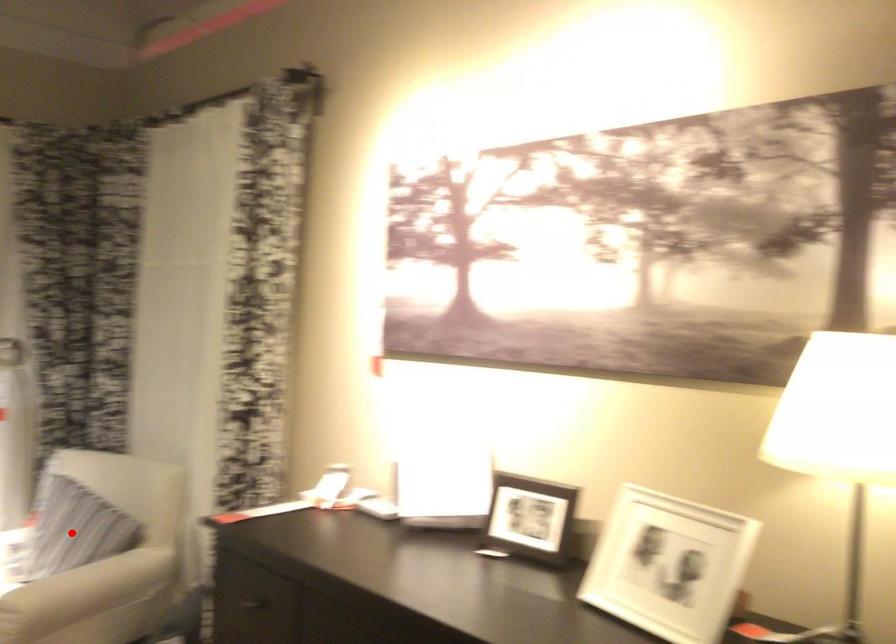
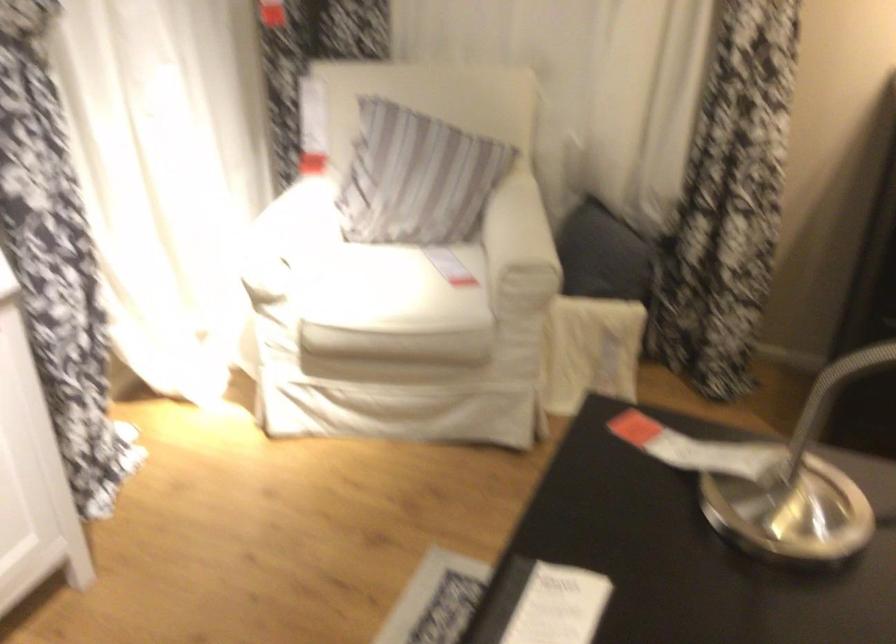
Find the pixel in the second image that matches the highlighted location in the first image.

(416, 178)